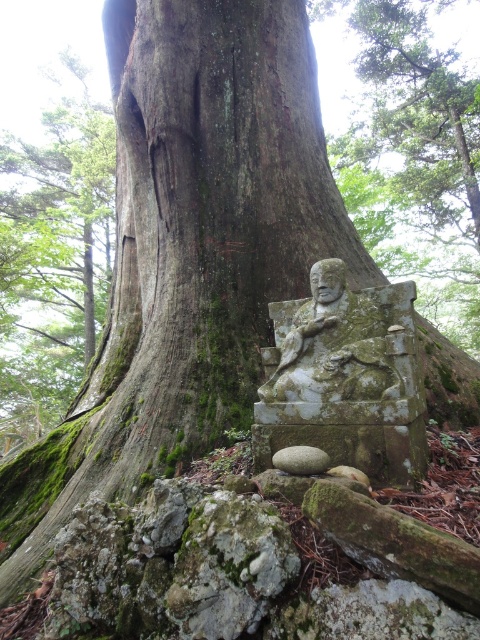
You are a hiker carrying a 1.5 meter long backpack. You want to place your backpack between the green mossy bark at lower left and the gray rough stone at lower center. Is there enough space for your backpack to fit between them?

The distance between the green mossy bark at lower left and the gray rough stone at lower center is 14.39 meters. Since your backpack is only 1.5 meters long, there is more than enough space to place it between them.

You are a hiker who wants to place a small marker between the green mossy stone statue at lower center and the green mossy bark at lower left. Based on their positions, where should you place the marker so it is directly in between them?

The green mossy stone statue at lower center is above the green mossy bark at lower left, so placing the marker halfway between them would require positioning it vertically between the two objects, closer to the middle point along the vertical axis.

You are standing in a forest and see two points marked on the ground. The first point is at coordinate point(368, 67) and the second point is at coordinate point(36, 310). Which point is closer to you?

Point(368, 67) is in front of point(36, 310), so it is closer to you.